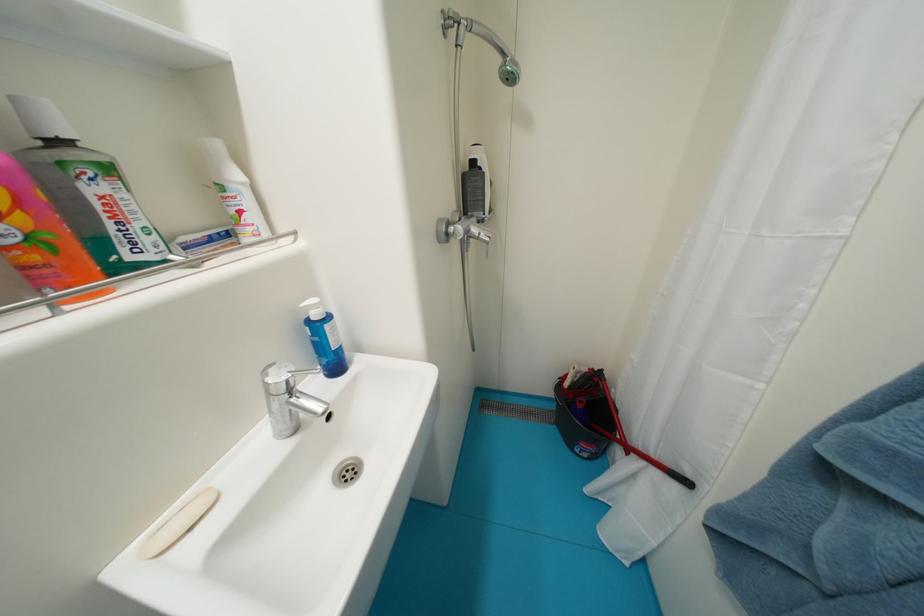
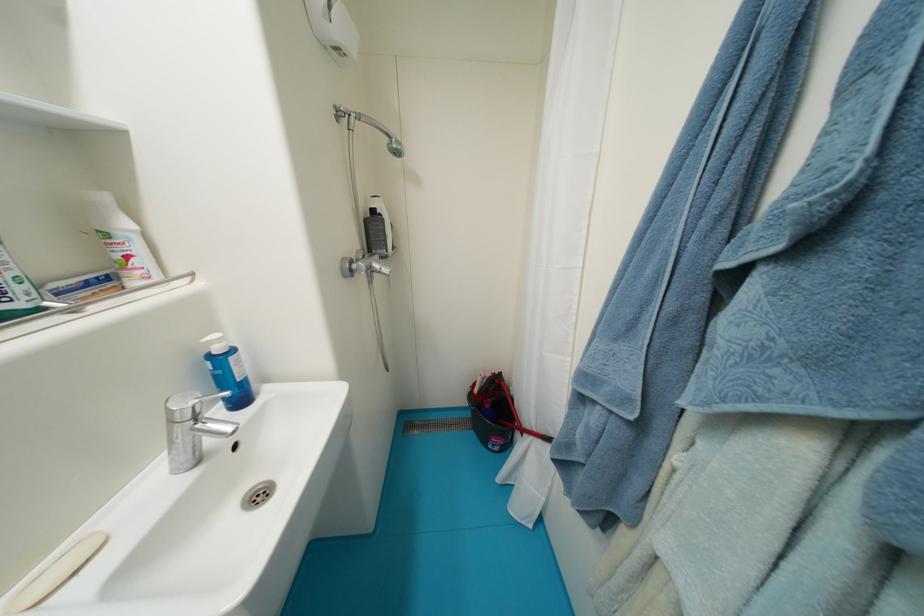
Where in the second image is the point corresponding to [481,231] from the first image?

(383, 267)